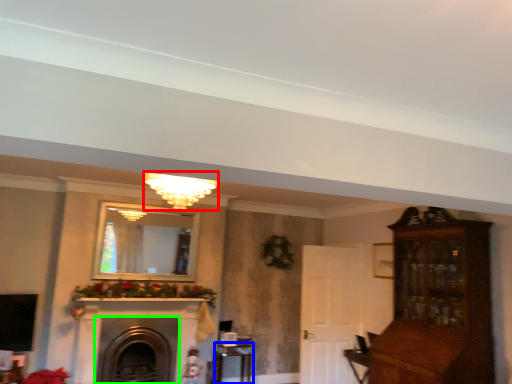
Question: Which object is positioned farthest from light fixture (highlighted by a red box)? Select from table (highlighted by a blue box) and fireplace (highlighted by a green box).

Choices:
 (A) table
 (B) fireplace

Answer: (A)